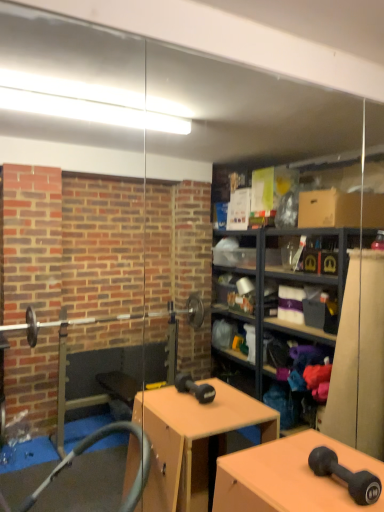
Question: Can you confirm if matte black dumbbell at lower right is wider than matte black dumbbell at center?

Choices:
 (A) no
 (B) yes

Answer: (A)

Question: Can you confirm if matte black dumbbell at lower right is positioned to the right of matte black dumbbell at center?

Choices:
 (A) no
 (B) yes

Answer: (B)

Question: Is matte black dumbbell at lower right in front of matte black dumbbell at center?

Choices:
 (A) yes
 (B) no

Answer: (B)

Question: Considering the relative positions of matte black dumbbell at lower right and matte black dumbbell at center in the image provided, is matte black dumbbell at lower right behind matte black dumbbell at center?

Choices:
 (A) yes
 (B) no

Answer: (A)

Question: From the image's perspective, is matte black dumbbell at lower right on top of matte black dumbbell at center?

Choices:
 (A) yes
 (B) no

Answer: (A)

Question: Does matte black dumbbell at lower right have a greater height compared to matte black dumbbell at center?

Choices:
 (A) no
 (B) yes

Answer: (A)

Question: Can you confirm if matte black dumbbell at center is taller than matte black dumbbell at lower right?

Choices:
 (A) yes
 (B) no

Answer: (A)

Question: Can you confirm if matte black dumbbell at center is thinner than matte black dumbbell at lower right?

Choices:
 (A) yes
 (B) no

Answer: (B)

Question: Is matte black dumbbell at center at the right side of matte black dumbbell at lower right?

Choices:
 (A) no
 (B) yes

Answer: (A)

Question: Is matte black dumbbell at lower right located within matte black dumbbell at center?

Choices:
 (A) yes
 (B) no

Answer: (B)

Question: From the image's perspective, would you say matte black dumbbell at center is positioned over matte black dumbbell at lower right?

Choices:
 (A) yes
 (B) no

Answer: (B)

Question: Does matte black dumbbell at center lie in front of matte black dumbbell at lower right?

Choices:
 (A) yes
 (B) no

Answer: (A)

Question: Do you think matte black dumbbell at center is within matte black dumbbell at lower right, or outside of it?

Choices:
 (A) outside
 (B) inside

Answer: (A)